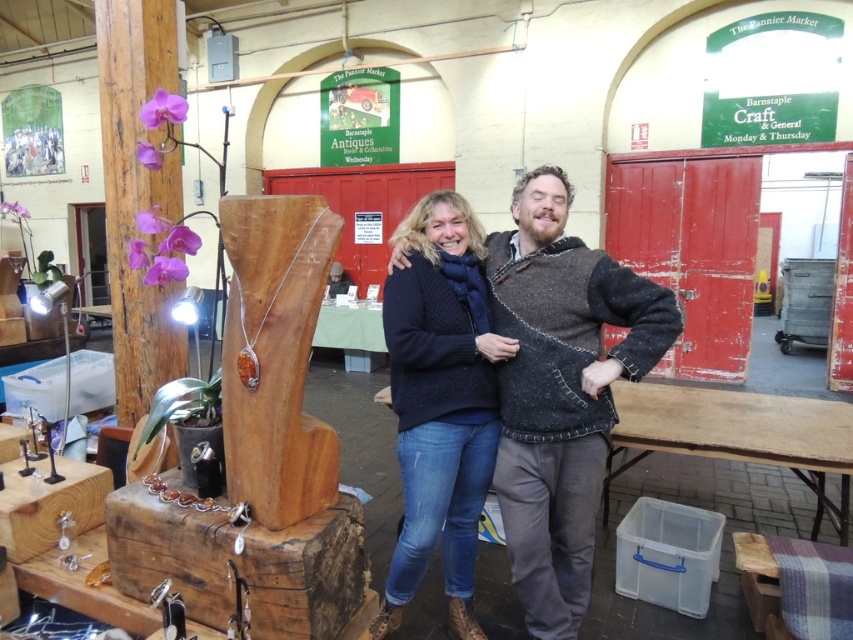
You are organizing a photo shoot at The Pannier Market and need to place a decorative item between the wooden sculpture at left and the knitted dark blue sweater at center. Which object should you place closer to the center of the image to ensure the decorative item is aligned properly?

The wooden sculpture at left might be wider than the knitted dark blue sweater at center, so placing the decorative item closer to the wooden sculpture at left would help align it properly considering their widths.

You are a photographer standing at the entrance of The Pannier Market. You want to take a photo of the knitted sweater at center and the red doors with signs in the background. Can you fit both in your camera frame if your camera has a 1.8 meter wide field of view?

The distance between the knitted sweater at center and the red doors with signs is 2.11 meters. Since the camera has a 1.8 meter wide field of view, which is narrower than the distance between them, you cannot fit both in the frame.

What is located at the point with coordinates (260, 451) in the image?

The wooden sculpture at left is located at the point with coordinates (260, 451) in the image.